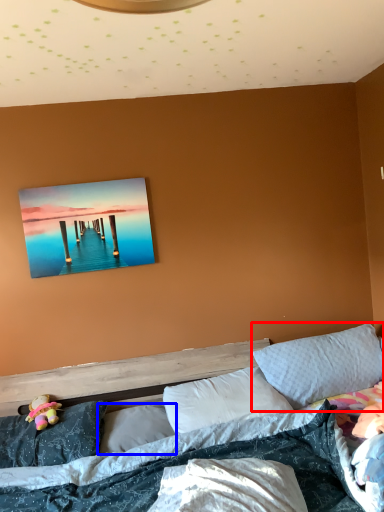
Question: Which object is closer to the camera taking this photo, pillow (highlighted by a red box) or pillow (highlighted by a blue box)?

Choices:
 (A) pillow
 (B) pillow

Answer: (B)